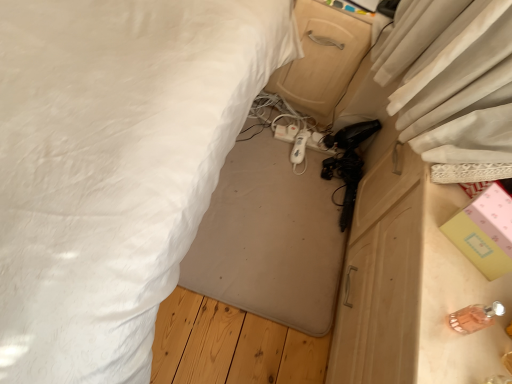
Identify the location of free space in front of pink paper box at right. (455, 291).